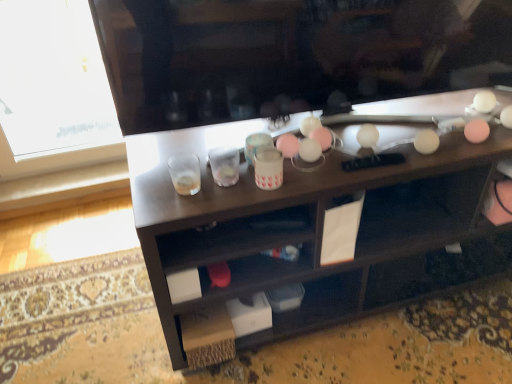
The image size is (512, 384). I want to click on vacant area situated to the left side of pink matte cup at center, so click(204, 186).